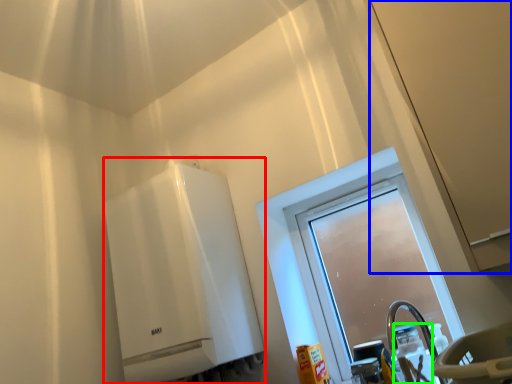
Question: Which object is positioned closest to water heater (highlighted by a red box)? Select from screen door (highlighted by a blue box) and bottle (highlighted by a green box).

Choices:
 (A) screen door
 (B) bottle

Answer: (B)